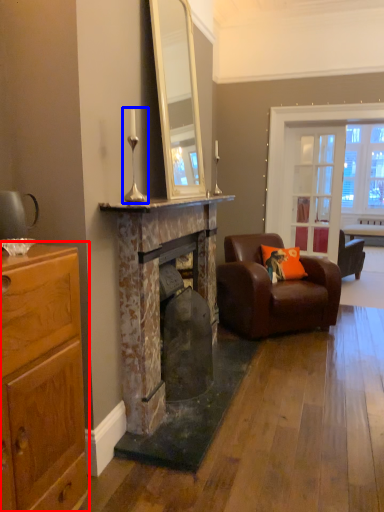
Question: Which of the following is the farthest to the observer, cabinetry (highlighted by a red box) or table lamp (highlighted by a blue box)?

Choices:
 (A) cabinetry
 (B) table lamp

Answer: (B)